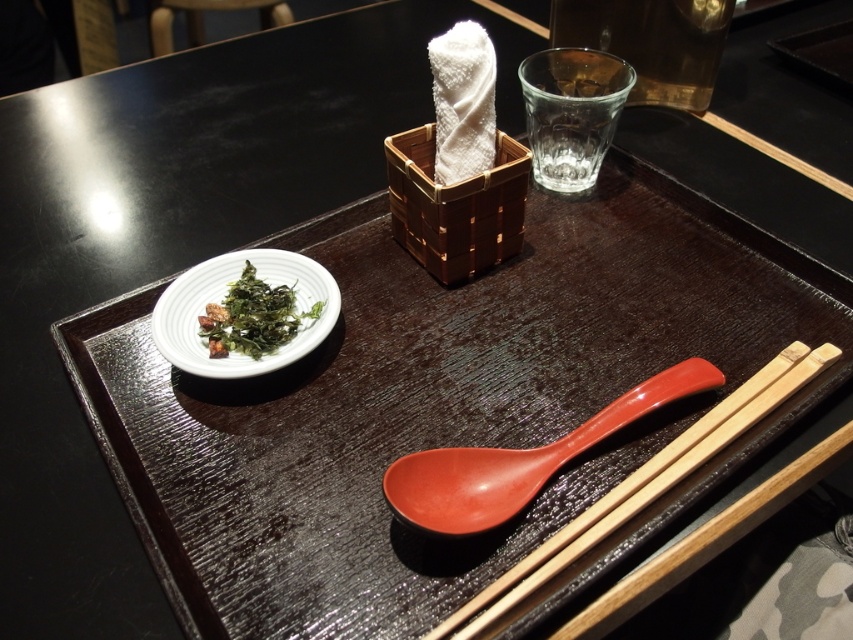
Consider the image. You are a waiter in a restaurant and need to place a new spoon at the exact position where the matte orange spoon at lower center is located. What are the coordinates of this position?

The coordinates of the position where the matte orange spoon at lower center is located are at point (518,461).